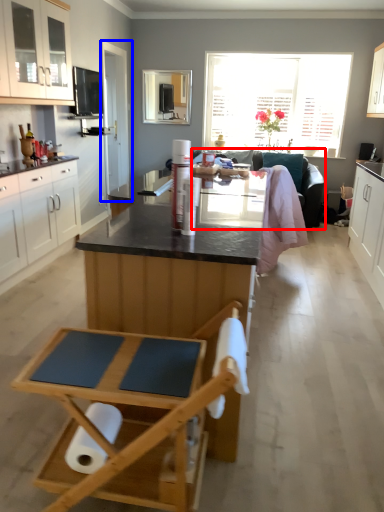
Question: Which of the following is the closest to the observer, couch (highlighted by a red box) or glass door (highlighted by a blue box)?

Choices:
 (A) couch
 (B) glass door

Answer: (A)